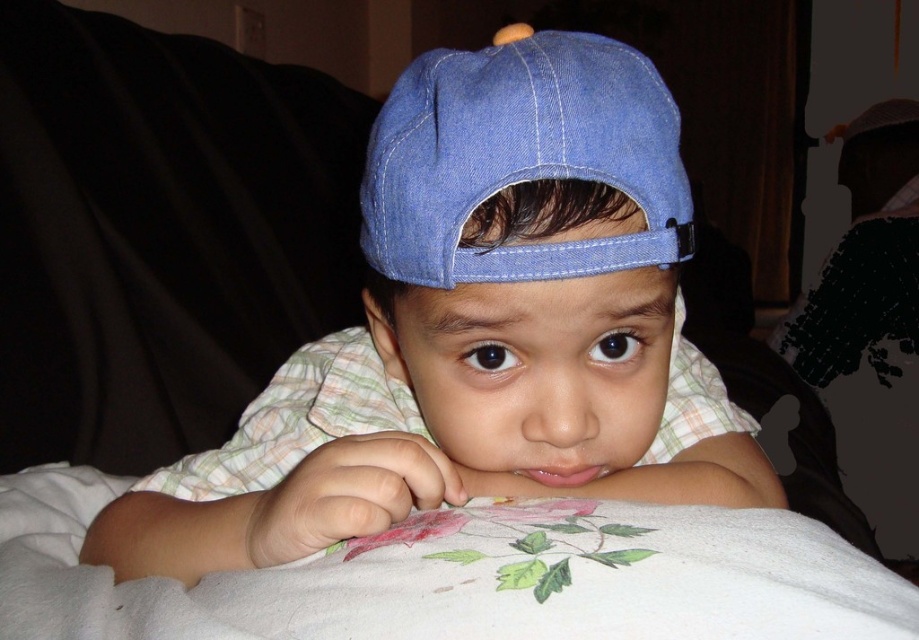
Is denim cap at center to the left of denim baseball cap at center from the viewer's perspective?

Yes, denim cap at center is to the left of denim baseball cap at center.

Is denim cap at center bigger than denim baseball cap at center?

Yes.

Who is more distant from viewer, (280, 483) or (584, 48)?

The point (280, 483) is behind.

Where is `denim cap at center`? denim cap at center is located at coordinates (478, 330).